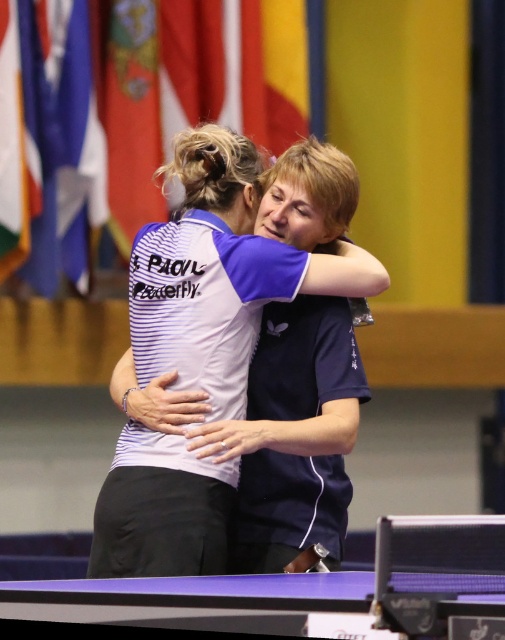
You are a photographer positioned at the back of the ping pong table. You want to take a photo of the white striped shirt at center and the purple glossy table tennis table at lower center. Which object should you focus on first if you want to capture both in clear detail?

The white striped shirt at center is located above the purple glossy table tennis table at lower center, so you should focus on the white striped shirt at center first to ensure both are in clear detail.

You are a photographer positioned at the back of the ping pong table. You need to capture a photo where both the white striped shirt at center and the purple glossy table tennis table at lower center are clearly visible. Based on their heights, which object will appear taller in the photo?

The white striped shirt at center will appear taller in the photo because it has a greater height compared to the purple glossy table tennis table at lower center according to the description.